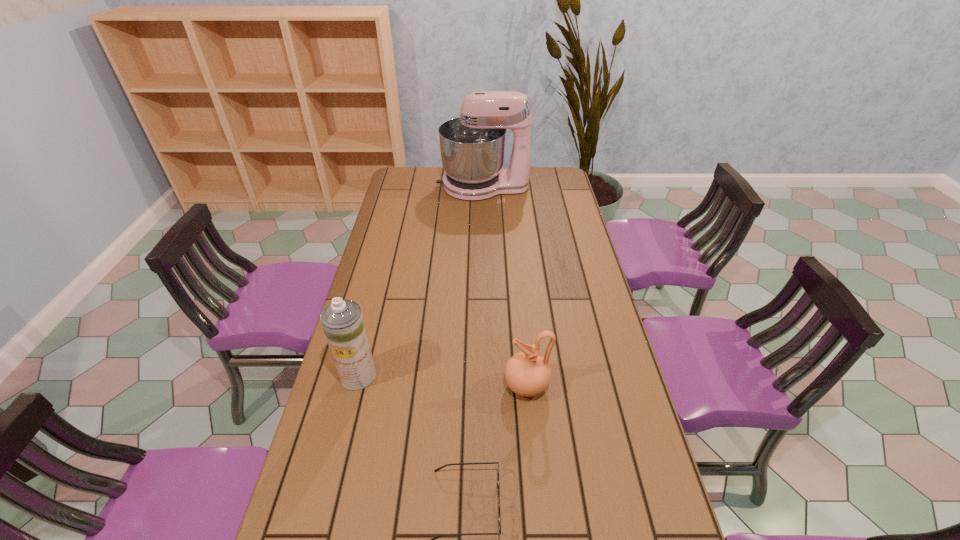
Locate an element on the screen. object that is the third closest one to the mixer is located at coordinates (433, 539).

Point out which object is positioned as the second nearest to the mixer. Please provide its 2D coordinates. Your answer should be formatted as a tuple, i.e. [(x, y)], where the tuple contains the x and y coordinates of a point satisfying the conditions above.

[(528, 374)]